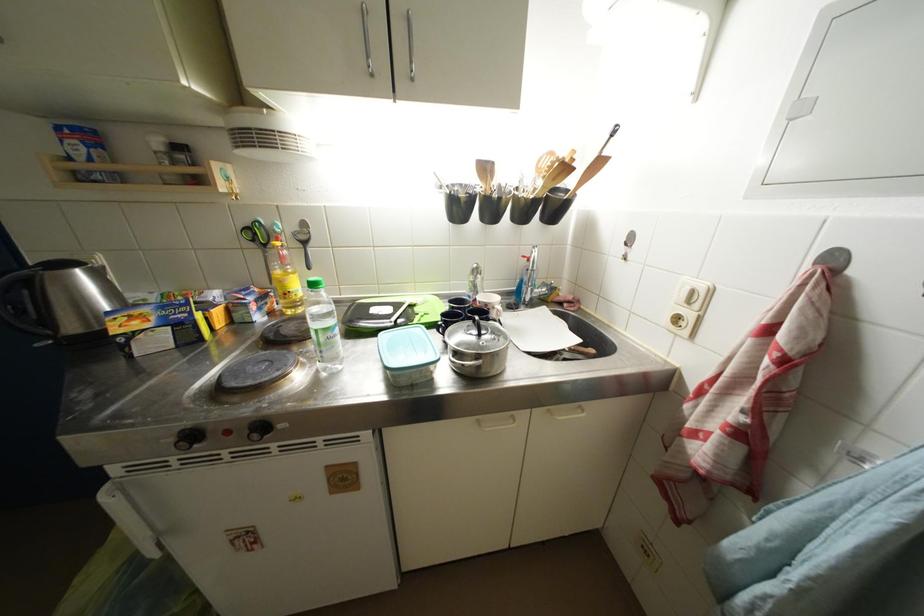
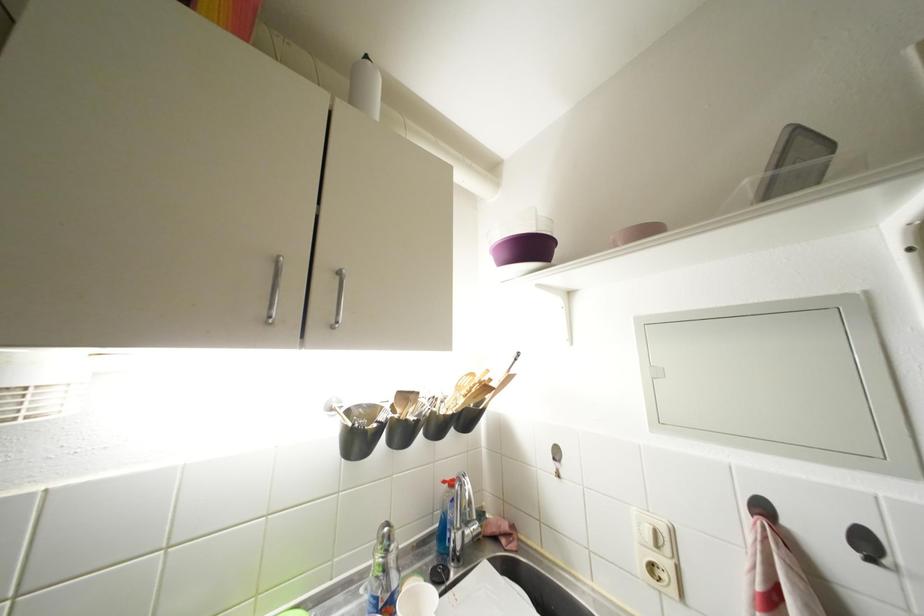
The point at (841,265) is marked in the first image. Where is the corresponding point in the second image?

(770, 513)